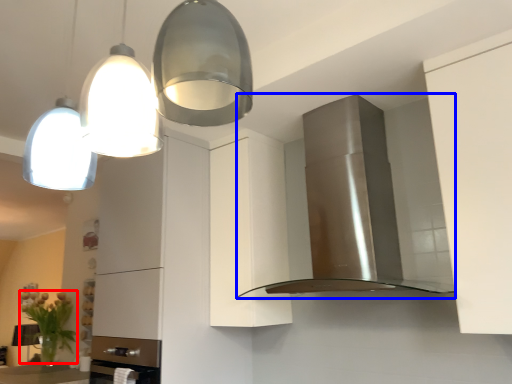
Question: Among these objects, which one is nearest to the camera, plant (highlighted by a red box) or home appliance (highlighted by a blue box)?

Choices:
 (A) plant
 (B) home appliance

Answer: (B)